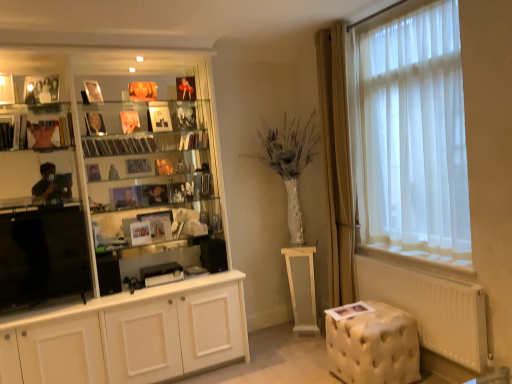
Question: Is tufted cream ottoman at lower right positioned far away from matte glass shelf at left?

Choices:
 (A) yes
 (B) no

Answer: (A)

Question: Can you confirm if tufted cream ottoman at lower right is wider than matte glass shelf at left?

Choices:
 (A) yes
 (B) no

Answer: (A)

Question: From a real-world perspective, is tufted cream ottoman at lower right over matte glass shelf at left?

Choices:
 (A) yes
 (B) no

Answer: (B)

Question: Considering the relative positions of tufted cream ottoman at lower right and matte glass shelf at left in the image provided, is tufted cream ottoman at lower right to the right of matte glass shelf at left from the viewer's perspective?

Choices:
 (A) no
 (B) yes

Answer: (B)

Question: Does tufted cream ottoman at lower right have a lesser width compared to matte glass shelf at left?

Choices:
 (A) yes
 (B) no

Answer: (B)

Question: In terms of height, does white glossy cupboard at left look taller or shorter compared to metallic glass book at center, the 4th book when ordered from top to bottom?

Choices:
 (A) tall
 (B) short

Answer: (A)

Question: From a real-world perspective, is white glossy cupboard at left physically located above or below metallic glass book at center, the 4th book when ordered from top to bottom?

Choices:
 (A) above
 (B) below

Answer: (B)

Question: Considering the positions of white glossy cupboard at left and metallic glass book at center, which is the second book from right to left, in the image, is white glossy cupboard at left bigger or smaller than metallic glass book at center, which is the second book from right to left,?

Choices:
 (A) small
 (B) big

Answer: (B)

Question: Choose the correct answer: Is white glossy cupboard at left inside metallic glass book at center, the 4th book positioned from the left, or outside it?

Choices:
 (A) inside
 (B) outside

Answer: (B)

Question: Considering their positions, is white glossy pedestal at center located in front of or behind white paper book at lower right, which is the 1th book in bottom-to-top order?

Choices:
 (A) behind
 (B) front

Answer: (A)

Question: From the image's perspective, is white glossy pedestal at center above or below white paper book at lower right, the 5th book viewed from the left?

Choices:
 (A) below
 (B) above

Answer: (A)

Question: Do you think white glossy pedestal at center is within white paper book at lower right, which is the 1th book from right to left, or outside of it?

Choices:
 (A) outside
 (B) inside

Answer: (A)

Question: Is white glossy pedestal at center bigger or smaller than white paper book at lower right, the 5th book viewed from the left?

Choices:
 (A) small
 (B) big

Answer: (B)

Question: Considering their positions, is transparent plastic cds at center, which is counted as the 2th book, starting from the left, located in front of or behind matte glass shelf at left?

Choices:
 (A) front
 (B) behind

Answer: (B)

Question: Considering the positions of point (108, 144) and point (65, 132), is point (108, 144) closer or farther from the camera than point (65, 132)?

Choices:
 (A) farther
 (B) closer

Answer: (A)